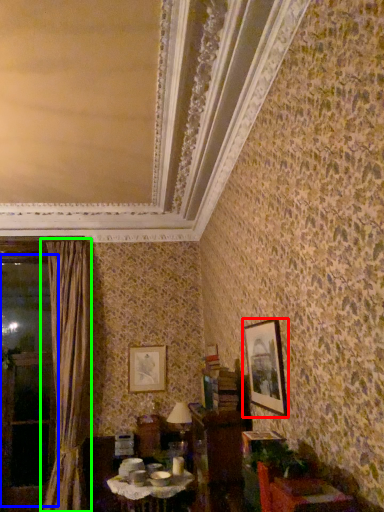
Question: Based on their relative distances, which object is nearer to picture frame (highlighted by a red box)? Choose from window (highlighted by a blue box) and curtain (highlighted by a green box).

Choices:
 (A) window
 (B) curtain

Answer: (B)